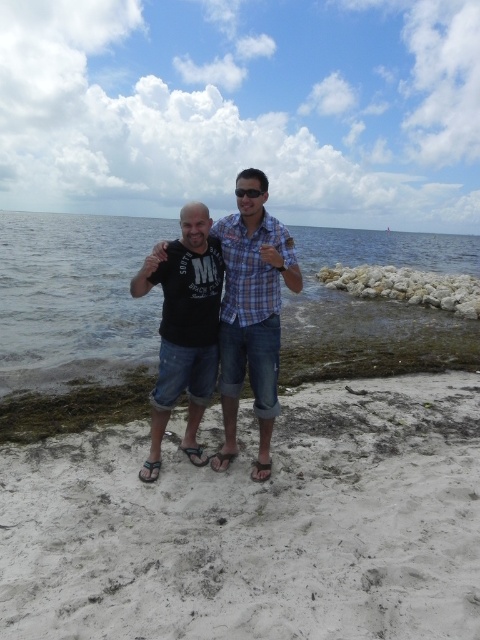
Is point (305, 332) less distant than point (165, 413)?

No.

Does clear water at lower left appear over black matte t-shirt at center?

Yes.

Locate an element on the screen. The height and width of the screenshot is (640, 480). clear water at lower left is located at coordinates (73, 298).

Between point (78, 346) and point (236, 250), which one is positioned behind?

Positioned behind is point (78, 346).

Can you confirm if clear water at lower left is taller than matte black shirt at center?

Indeed, clear water at lower left has a greater height compared to matte black shirt at center.

Which is behind, point (48, 240) or point (252, 212)?

Point (48, 240)

Locate an element on the screen. The image size is (480, 640). clear water at lower left is located at coordinates (73, 298).

Does white sandy beach at center appear over black matte t-shirt at center?

Incorrect, white sandy beach at center is not positioned above black matte t-shirt at center.

Can you confirm if white sandy beach at center is wider than black matte t-shirt at center?

Correct, the width of white sandy beach at center exceeds that of black matte t-shirt at center.

Is point (84, 451) less distant than point (171, 310)?

No, it is not.

You are a GUI agent. You are given a task and a screenshot of the screen. Output one action in this format:
    pyautogui.click(x=<x>, y=<y>)
    Task: Click on the white sandy beach at center
    The height and width of the screenshot is (640, 480).
    Given the screenshot: What is the action you would take?
    pyautogui.click(x=255, y=525)